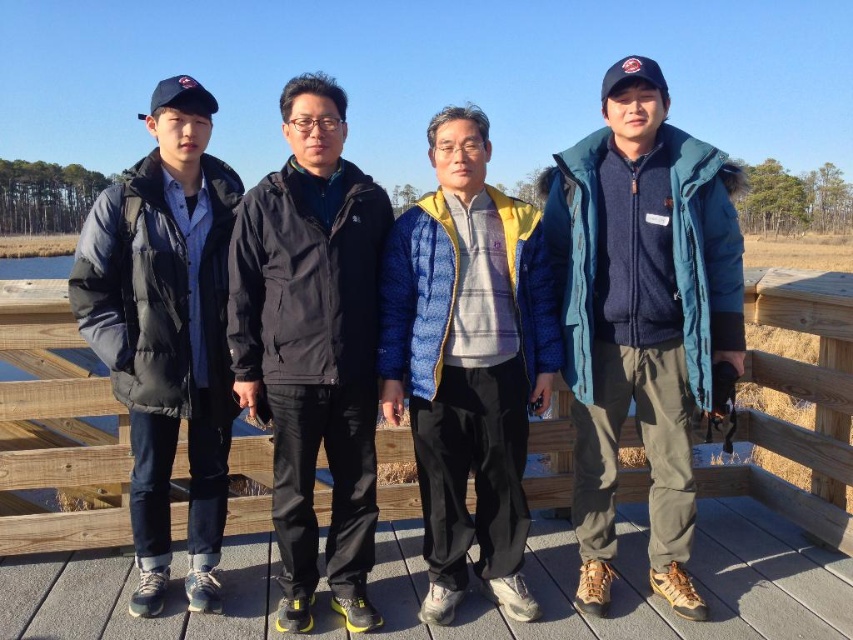
Question: Which point appears closest to the camera in this image?

Choices:
 (A) (306, 230)
 (B) (437, 396)
 (C) (732, 275)

Answer: (A)

Question: Does matte black jacket at left have a smaller size compared to wooden rail at center?

Choices:
 (A) no
 (B) yes

Answer: (B)

Question: Which object is the farthest from the blue down jacket at center?

Choices:
 (A) teal fleece jacket at center
 (B) matte black jacket at left
 (C) wooden rail at center
 (D) black matte jacket at center

Answer: (C)

Question: Does matte black jacket at left appear under wooden rail at center?

Choices:
 (A) yes
 (B) no

Answer: (B)

Question: Is teal fleece jacket at center further to the viewer compared to matte black jacket at left?

Choices:
 (A) no
 (B) yes

Answer: (B)

Question: Considering the real-world distances, which object is farthest from the blue down jacket at center?

Choices:
 (A) wooden rail at center
 (B) black matte jacket at center
 (C) teal fleece jacket at center

Answer: (A)